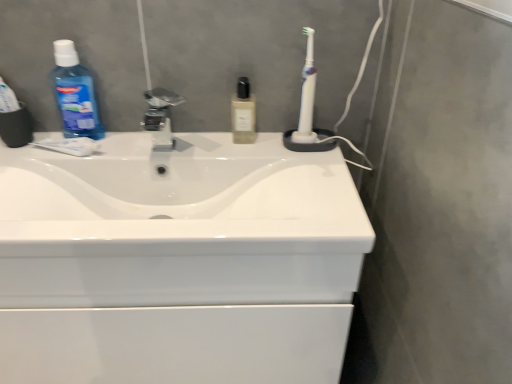
At what (x,y) coordinates should I click in order to perform the action: click on vacant point to the left of translucent glass bottle at center. Please return your answer as a coordinate pair (x, y). The image size is (512, 384). Looking at the image, I should click on (187, 138).